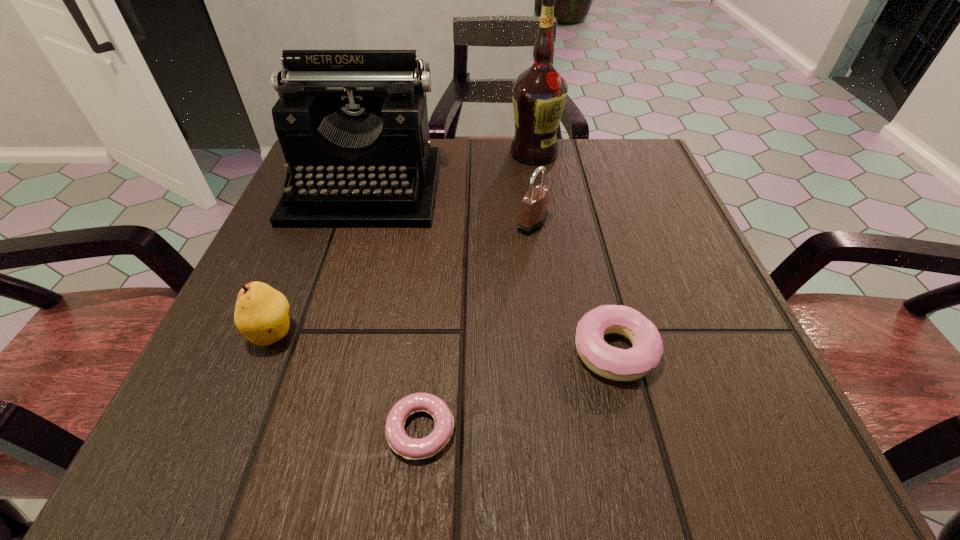
You are a GUI agent. You are given a task and a screenshot of the screen. Output one action in this format:
    pyautogui.click(x=<x>, y=<y>)
    Task: Click on the tallest object
    
    Given the screenshot: What is the action you would take?
    pyautogui.click(x=539, y=94)

Identify the location of typewriter. The width and height of the screenshot is (960, 540). (353, 127).

The height and width of the screenshot is (540, 960). Find the location of `padlock`. padlock is located at coordinates (534, 204).

Image resolution: width=960 pixels, height=540 pixels. I want to click on pear, so click(261, 314).

Identify the location of the taller doughnut. The width and height of the screenshot is (960, 540). (613, 363).

Image resolution: width=960 pixels, height=540 pixels. I want to click on the right doughnut, so click(613, 363).

This screenshot has width=960, height=540. Find the location of `the shorter doughnut`. the shorter doughnut is located at coordinates (410, 448).

The width and height of the screenshot is (960, 540). Identify the location of the nearer doughnut. (410, 448).

Locate an element on the screen. Image resolution: width=960 pixels, height=540 pixels. free space located 0.210m on the label of the tallest object is located at coordinates (546, 230).

Identify the location of vacant area situated 0.180m on the typing side of the second tallest object. (328, 303).